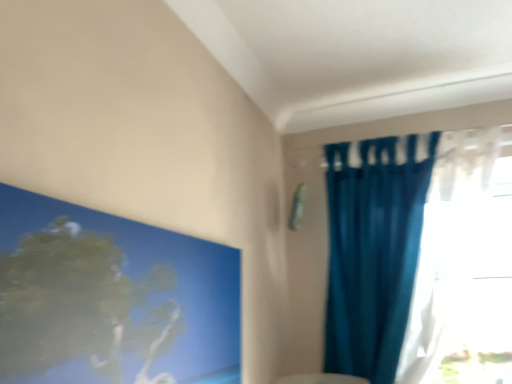
Question: Is teal fabric curtain at right at the right side of smooth blue painting at upper left?

Choices:
 (A) no
 (B) yes

Answer: (B)

Question: Considering the relative sizes of teal fabric curtain at right and smooth blue painting at upper left in the image provided, is teal fabric curtain at right smaller than smooth blue painting at upper left?

Choices:
 (A) yes
 (B) no

Answer: (B)

Question: Does teal fabric curtain at right have a greater height compared to smooth blue painting at upper left?

Choices:
 (A) no
 (B) yes

Answer: (B)

Question: From a real-world perspective, is teal fabric curtain at right physically below smooth blue painting at upper left?

Choices:
 (A) yes
 (B) no

Answer: (B)

Question: Can you confirm if teal fabric curtain at right is shorter than smooth blue painting at upper left?

Choices:
 (A) yes
 (B) no

Answer: (B)

Question: Is teal fabric curtain at right with smooth blue painting at upper left?

Choices:
 (A) yes
 (B) no

Answer: (B)

Question: Does smooth blue painting at upper left have a larger size compared to teal fabric curtain at right?

Choices:
 (A) no
 (B) yes

Answer: (A)

Question: Is smooth blue painting at upper left in front of teal fabric curtain at right?

Choices:
 (A) no
 (B) yes

Answer: (B)

Question: From a real-world perspective, is smooth blue painting at upper left under teal fabric curtain at right?

Choices:
 (A) yes
 (B) no

Answer: (A)

Question: From a real-world perspective, is smooth blue painting at upper left physically above teal fabric curtain at right?

Choices:
 (A) no
 (B) yes

Answer: (A)

Question: From the image's perspective, would you say smooth blue painting at upper left is positioned over teal fabric curtain at right?

Choices:
 (A) yes
 (B) no

Answer: (B)

Question: Is smooth blue painting at upper left looking in the opposite direction of teal fabric curtain at right?

Choices:
 (A) no
 (B) yes

Answer: (A)

Question: In the image, is teal fabric curtain at right positioned in front of or behind smooth blue painting at upper left?

Choices:
 (A) front
 (B) behind

Answer: (B)